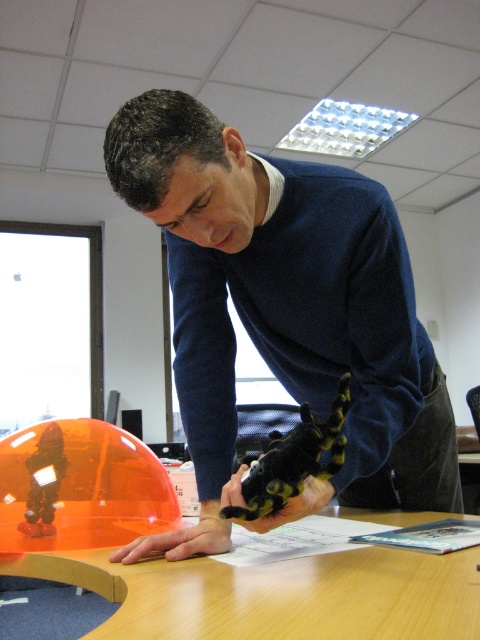
You are a person trying to place a small object on the glossy plastic table at center. However, there is a smooth skin hand at center in the way. Can you place the object on the table without moving the hand?

The glossy plastic table at center is closer to the viewer than the smooth skin hand at center, so the hand is blocking the direct path to the table. You would need to move the hand to place the object on the table.

You are organizing a toy exhibition and need to place the black fuzzy toy at center on the glossy plastic table at center. Will the toy fit entirely on the table without hanging over the edges?

The glossy plastic table at center is wider than the black fuzzy toy at center, so the toy will fit entirely on the table without hanging over the edges.

Please provide the exact 2D coordinates of the smooth skin hand at center in the image. The answer should be in the format of point followed by the coordinates in parentheses. Do not include any other information.

The smooth skin hand at center is located at point (180, 540).